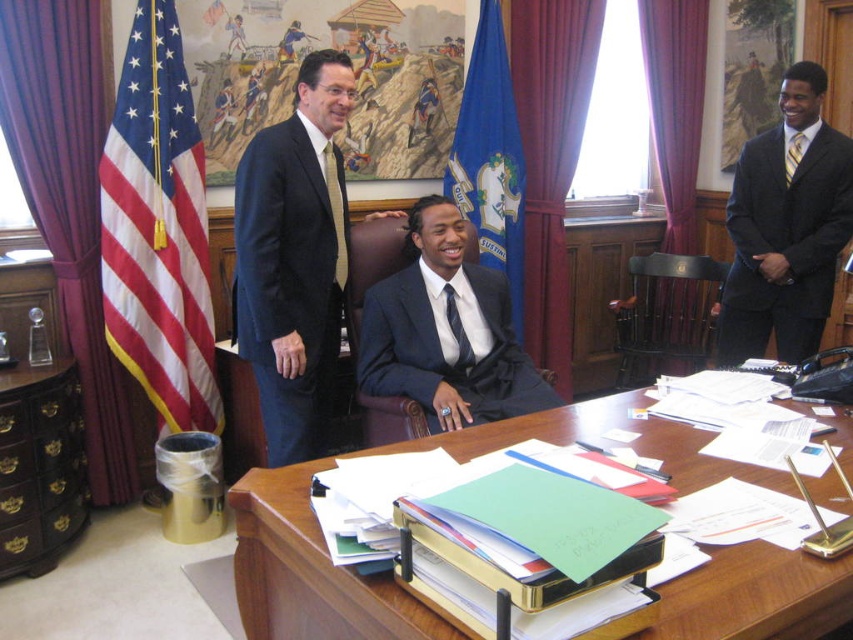
Does wooden desk at center have a greater height compared to yellow striped tie at center?

Yes.

Between wooden desk at center and yellow striped tie at center, which one is positioned lower?

Positioned lower is wooden desk at center.

Is point (724, 593) closer to viewer compared to point (796, 157)?

Yes, point (724, 593) is in front of point (796, 157).

In order to click on wooden desk at center in this screenshot , I will do `click(309, 572)`.

Between dark blue wool suit at center and blue fabric flag at center, which one has less height?

dark blue wool suit at center is shorter.

What do you see at coordinates (289, 280) in the screenshot? The width and height of the screenshot is (853, 640). I see `dark blue wool suit at center` at bounding box center [289, 280].

Does point (279, 253) come in front of point (474, 108)?

That is True.

The height and width of the screenshot is (640, 853). What are the coordinates of `dark blue wool suit at center` in the screenshot? It's located at (289, 280).

Where is `red-white-striped flag at left`? red-white-striped flag at left is located at coordinates (158, 228).

What do you see at coordinates (158, 228) in the screenshot?
I see `red-white-striped flag at left` at bounding box center [158, 228].

Identify the location of red-white-striped flag at left. (158, 228).